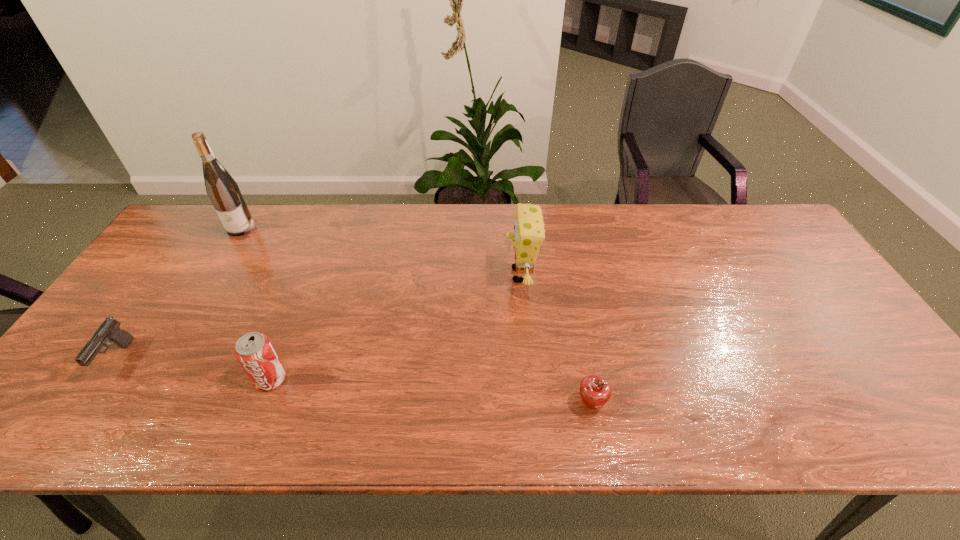
You are a GUI agent. You are given a task and a screenshot of the screen. Output one action in this format:
    pyautogui.click(x=<x>, y=<y>)
    Task: Click on the second object from left to right
    Image resolution: width=960 pixels, height=540 pixels.
    Given the screenshot: What is the action you would take?
    pyautogui.click(x=223, y=191)

Image resolution: width=960 pixels, height=540 pixels. Find the location of `the farthest object`. the farthest object is located at coordinates (223, 191).

Locate an element on the screen. The height and width of the screenshot is (540, 960). the second farthest object is located at coordinates (529, 229).

At what (x,y) coordinates should I click in order to perform the action: click on the second object from right to left. Please return your answer as a coordinate pair (x, y). Looking at the image, I should click on (529, 229).

Where is `the third object from right to left`? the third object from right to left is located at coordinates (255, 353).

Locate an element on the screen. the third shortest object is located at coordinates (255, 353).

You are a GUI agent. You are given a task and a screenshot of the screen. Output one action in this format:
    pyautogui.click(x=<x>, y=<y>)
    Task: Click on the leftmost object
    
    Given the screenshot: What is the action you would take?
    pyautogui.click(x=110, y=330)

You are a GUI agent. You are given a task and a screenshot of the screen. Output one action in this format:
    pyautogui.click(x=<x>, y=<y>)
    Task: Click on the rightmost object
    Image resolution: width=960 pixels, height=540 pixels.
    Given the screenshot: What is the action you would take?
    pyautogui.click(x=595, y=392)

Locate an element on the screen. The height and width of the screenshot is (540, 960). vacant space located on the front of the fourth object from right to left is located at coordinates (222, 260).

Find the location of a particular element. This screenshot has width=960, height=540. vacant position located 0.350m on the face of the second farthest object is located at coordinates (383, 275).